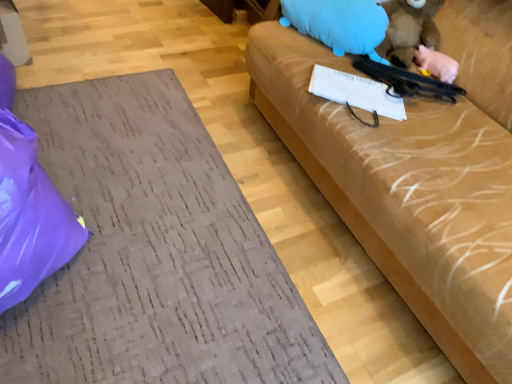
Where is `vacant space underneath matte brown couch at right (from a real-world perspective)`? This screenshot has height=384, width=512. vacant space underneath matte brown couch at right (from a real-world perspective) is located at coordinates (136, 211).